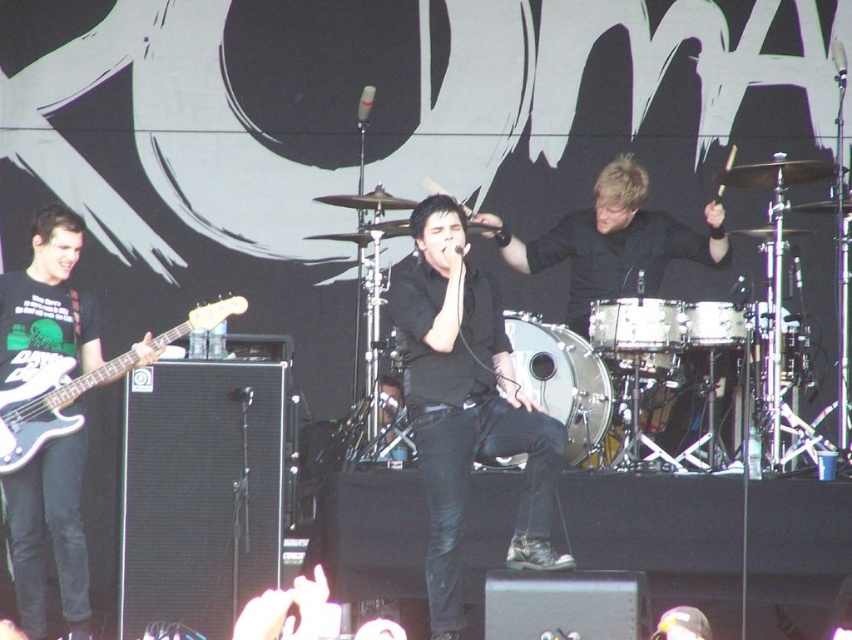
Which is above, matte black guitar at left or white matte electric guitar at left?

white matte electric guitar at left

Consider the image. Who is more distant from viewer, (68, 468) or (55, 394)?

Positioned behind is point (68, 468).

Image resolution: width=852 pixels, height=640 pixels. What are the coordinates of `matte black guitar at left` in the screenshot? It's located at (49, 534).

Does black matte shirt at center come behind matte black guitar at left?

No, black matte shirt at center is closer to the viewer.

The image size is (852, 640). Find the location of `black matte shirt at center`. black matte shirt at center is located at coordinates (465, 404).

Who is more distant from viewer, (528,536) or (27,518)?

The point (27,518) is behind.

You are a GUI agent. You are given a task and a screenshot of the screen. Output one action in this format:
    pyautogui.click(x=<x>, y=<y>)
    Task: Click on the black matte shirt at center
    This screenshot has width=852, height=640.
    Given the screenshot: What is the action you would take?
    pyautogui.click(x=465, y=404)

Describe the element at coordinates (465, 404) in the screenshot. I see `black matte shirt at center` at that location.

Is point (429, 566) farther from viewer compared to point (73, 381)?

No, (429, 566) is closer to viewer.

Who is more forward, (550, 467) or (24, 452)?

Point (550, 467) is more forward.

Locate an element on the screen. This screenshot has height=640, width=852. black matte shirt at center is located at coordinates (465, 404).